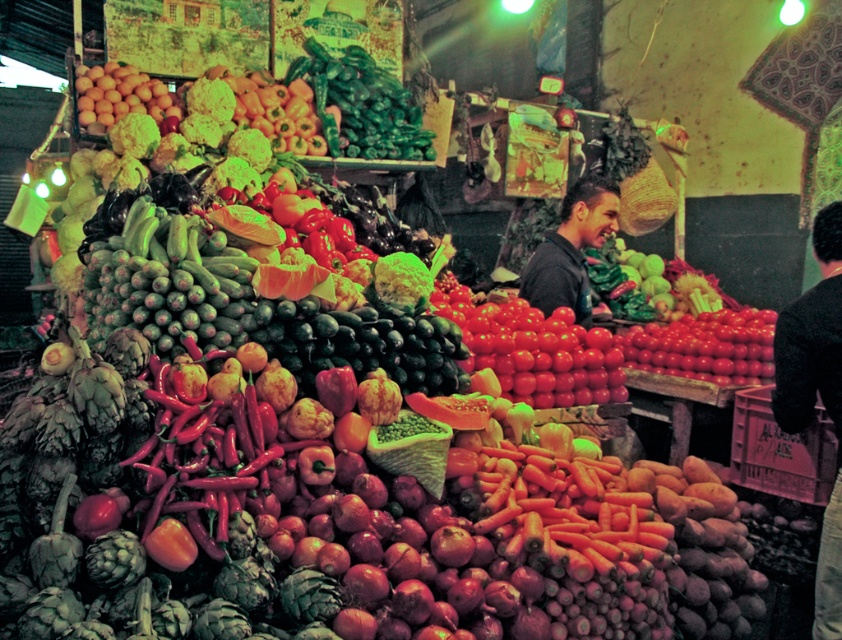
Is black sweater at right wider than shiny red tomatoes at center?

No, black sweater at right is not wider than shiny red tomatoes at center.

What do you see at coordinates (814, 394) in the screenshot? This screenshot has width=842, height=640. I see `black sweater at right` at bounding box center [814, 394].

I want to click on black sweater at right, so click(814, 394).

Does point (264, 358) come behind point (100, 76)?

No, (264, 358) is closer to viewer.

Does smooth red chili pepper at center have a greater height compared to smooth yellow oranges at upper left?

Correct, smooth red chili pepper at center is much taller as smooth yellow oranges at upper left.

Does point (257, 464) come closer to viewer compared to point (163, 118)?

Yes.

Identify the location of smooth red chili pepper at center. (216, 449).

Which is behind, point (147, 518) or point (563, 380)?

The point (563, 380) is behind.

At what (x,y) coordinates should I click in order to perform the action: click on smooth red chili pepper at center. Please return your answer as a coordinate pair (x, y). The width and height of the screenshot is (842, 640). Looking at the image, I should click on (216, 449).

Which is in front, point (169, 445) or point (482, 356)?

Point (169, 445) is more forward.

Where is `smooth red chili pepper at center`? This screenshot has height=640, width=842. smooth red chili pepper at center is located at coordinates (216, 449).